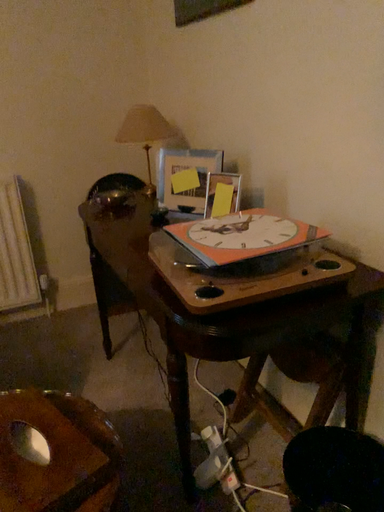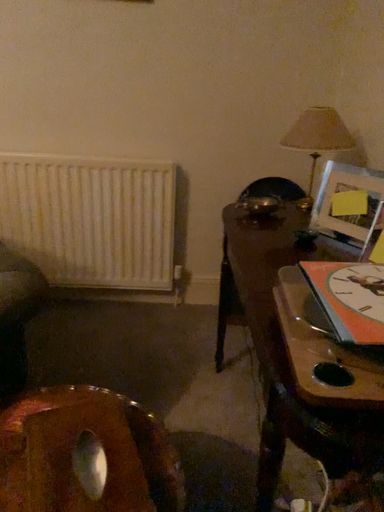
Question: Which way did the camera rotate in the video?

Choices:
 (A) rotated right
 (B) rotated left

Answer: (B)